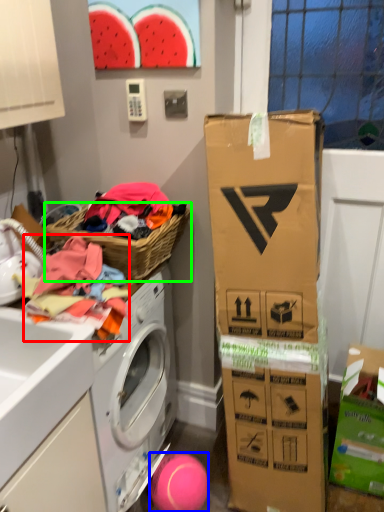
Question: Which object is positioned farthest from clothing (highlighted by a red box)? Select from ball (highlighted by a blue box) and picnic basket (highlighted by a green box).

Choices:
 (A) ball
 (B) picnic basket

Answer: (A)